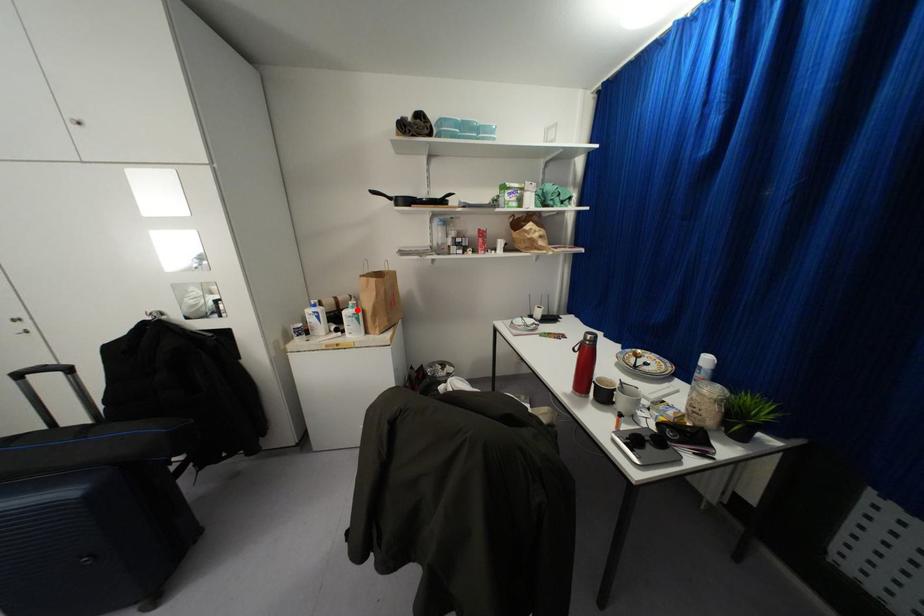
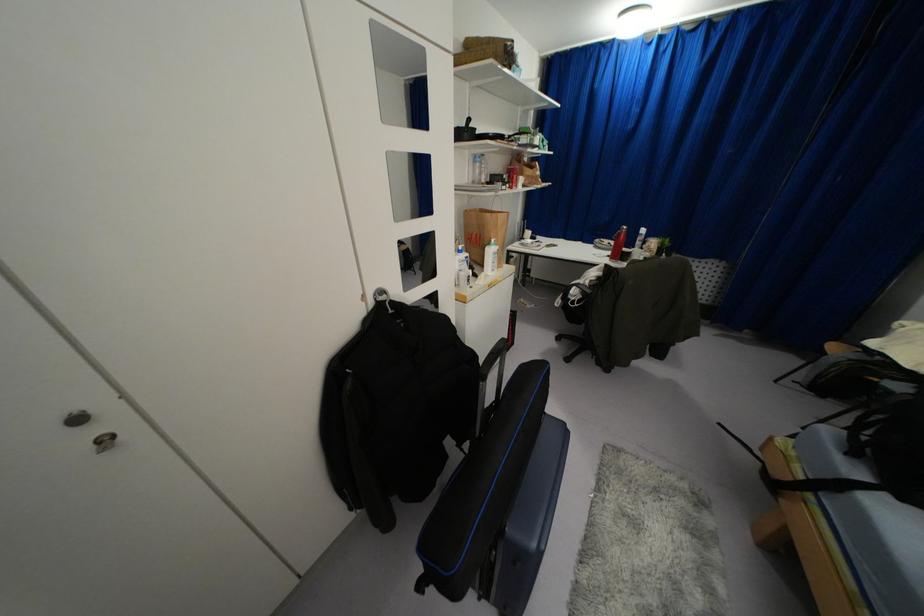
In the second image, find the point that corresponds to the highlighted location in the first image.

(495, 246)